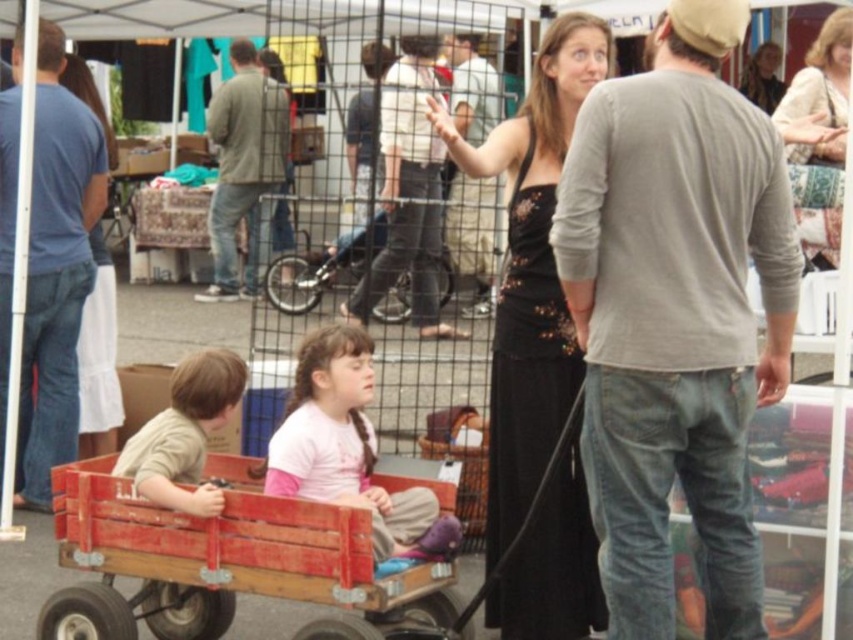
Question: Is gray cotton shirt at center positioned before light brown smooth shirt at lower left?

Choices:
 (A) yes
 (B) no

Answer: (B)

Question: Observing the image, what is the correct spatial positioning of green cotton shirt at center in reference to black lace dress at upper center?

Choices:
 (A) below
 (B) above

Answer: (B)

Question: Which object is the farthest from the gray cotton shirt at upper center?

Choices:
 (A) gray cotton shirt at center
 (B) blue denim jeans at left
 (C) pink cotton shirt at center
 (D) light brown smooth shirt at lower left

Answer: (D)

Question: Based on their relative distances, which object is nearer to the gray cotton shirt at center?

Choices:
 (A) light brown smooth shirt at lower left
 (B) light beige textured sweater at upper right
 (C) wooden wagon at center
 (D) gray long-sleeved shirt at center

Answer: (B)

Question: Which object is positioned closest to the pink cotton shirt at center?

Choices:
 (A) light brown smooth shirt at lower left
 (B) green cotton shirt at center
 (C) light beige textured sweater at upper right
 (D) black lace dress at upper center

Answer: (A)

Question: Is black lace dress at center in front of gray cotton shirt at center?

Choices:
 (A) yes
 (B) no

Answer: (A)